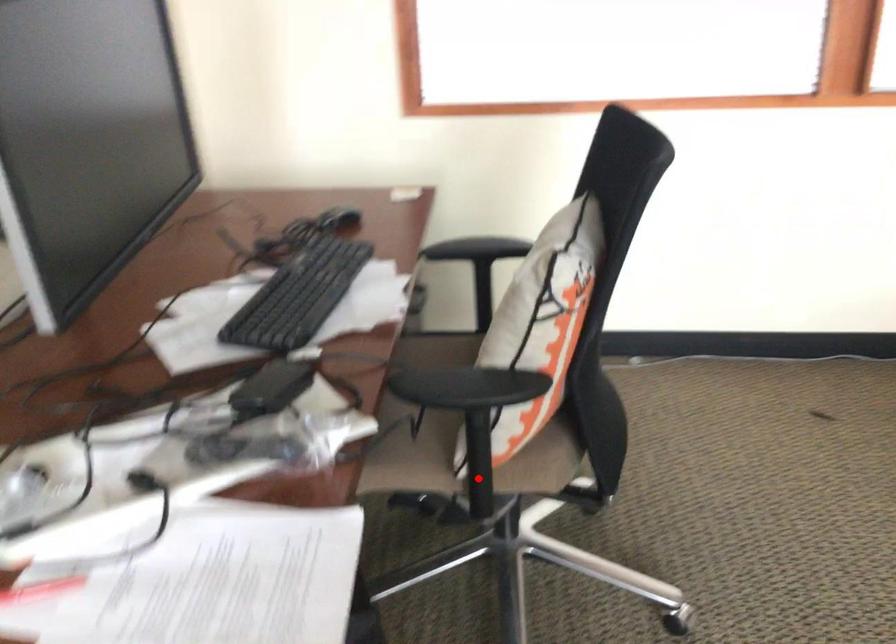
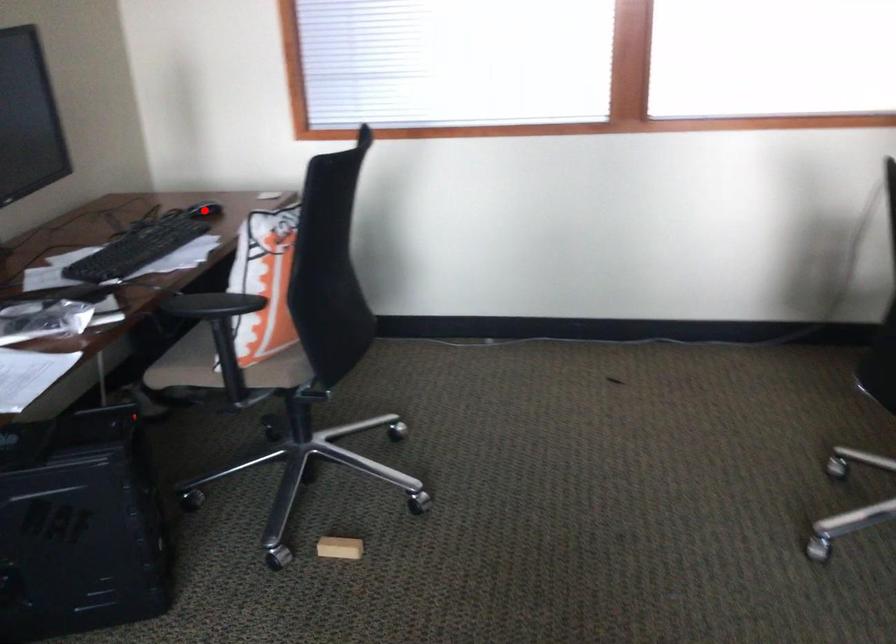
I am providing you with two images of the same scene from different viewpoints. A red point is marked on the first image and another point is marked on the second image. Do the highlighted points in image1 and image2 indicate the same real-world spot?

No